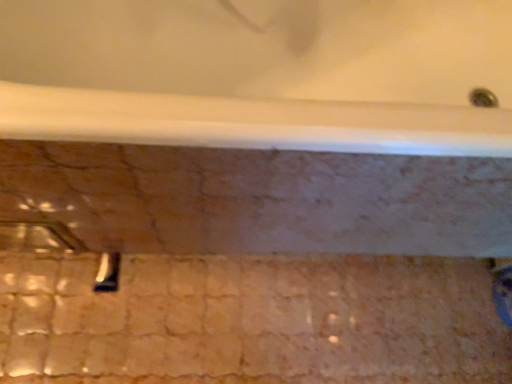
What do you see at coordinates (259, 75) in the screenshot?
I see `white marble bathtub at center` at bounding box center [259, 75].

What is the approximate height of white marble bathtub at center?

The height of white marble bathtub at center is 23.84 inches.

Identify the location of white marble bathtub at center. (259, 75).

What are the coordinates of `white marble bathtub at center` in the screenshot? It's located at (259, 75).